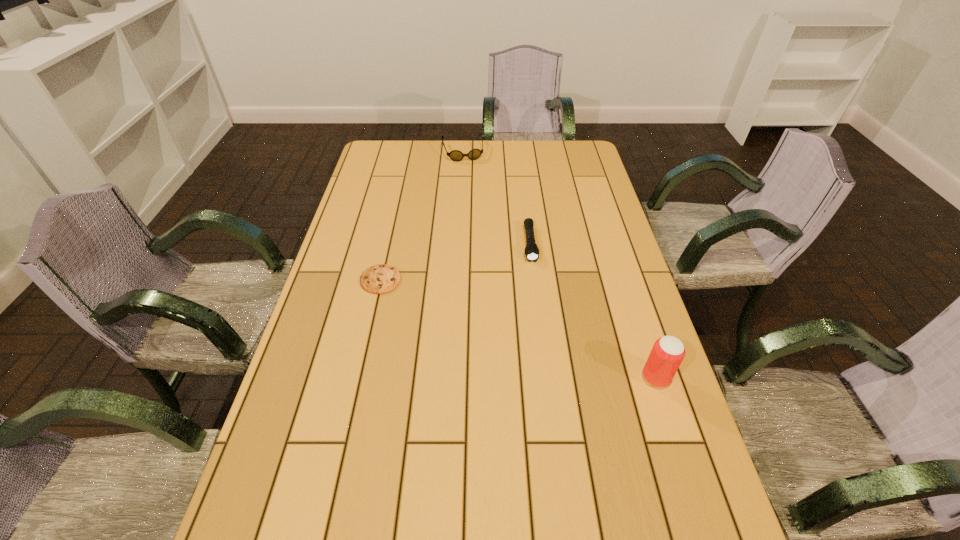
I want to click on free region located 0.120m on the lenses of the farthest object, so click(469, 179).

Identify the location of vacant space situated on the lenses of the farthest object. The image size is (960, 540). (478, 215).

Find the location of `free space located 0.100m on the lenses of the farthest object`. free space located 0.100m on the lenses of the farthest object is located at coordinates (468, 176).

This screenshot has width=960, height=540. Find the location of `vacant space located at the lens end of the flashlight`. vacant space located at the lens end of the flashlight is located at coordinates (540, 334).

Locate an element on the screen. The image size is (960, 540). blank space located 0.190m at the lens end of the flashlight is located at coordinates (538, 311).

You are a GUI agent. You are given a task and a screenshot of the screen. Output one action in this format:
    pyautogui.click(x=<x>, y=<y>)
    Task: Click on the vacant region located at the lens end of the flashlight
    Image resolution: width=960 pixels, height=540 pixels.
    Given the screenshot: What is the action you would take?
    pyautogui.click(x=543, y=361)

You are a GUI agent. You are given a task and a screenshot of the screen. Output one action in this format:
    pyautogui.click(x=<x>, y=<y>)
    Task: Click on the object that is at the far edge
    Image resolution: width=960 pixels, height=540 pixels.
    Given the screenshot: What is the action you would take?
    pyautogui.click(x=455, y=155)

I want to click on object located at the left edge, so click(x=382, y=278).

The height and width of the screenshot is (540, 960). In order to click on object that is at the right edge in this screenshot , I will do `click(668, 352)`.

I want to click on free space at the far edge of the desktop, so click(522, 170).